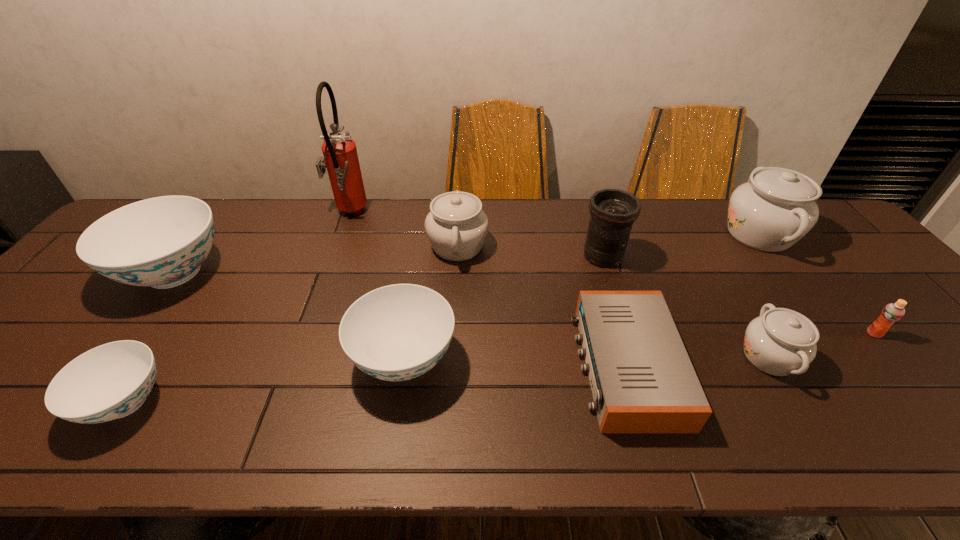
Find the location of a particular element. The image size is (960, 540). free space located on the back of the orange juice is located at coordinates (800, 245).

Identify the location of vacant space located 0.130m on the back of the shortest chinaware. (178, 322).

In order to click on free space located 0.130m on the front panel of the shortest object in this screenshot , I will do `click(521, 366)`.

At what (x,y) coordinates should I click in order to perform the action: click on free space located 0.190m on the front panel of the shortest object. Please return your answer as a coordinate pair (x, y). Looking at the image, I should click on (494, 366).

You are a GUI agent. You are given a task and a screenshot of the screen. Output one action in this format:
    pyautogui.click(x=<x>, y=<y>)
    Task: Click on the vacant space located on the front panel of the shortest object
    The width and height of the screenshot is (960, 540).
    Given the screenshot: What is the action you would take?
    pyautogui.click(x=521, y=366)

Where is `fire extinguisher positioned at the far edge`? fire extinguisher positioned at the far edge is located at coordinates (340, 154).

Locate an element on the screen. This screenshot has width=960, height=540. telephoto lens located in the far edge section of the desktop is located at coordinates pyautogui.click(x=613, y=211).

You are a GUI agent. You are given a task and a screenshot of the screen. Output one action in this format:
    pyautogui.click(x=<x>, y=<y>)
    Task: Click on the chinaware that is at the near edge
    
    Given the screenshot: What is the action you would take?
    pyautogui.click(x=111, y=381)

Identify the location of radio receiver that is at the near edge. (642, 380).

Locate an element on the screen. object that is at the left edge is located at coordinates (161, 242).